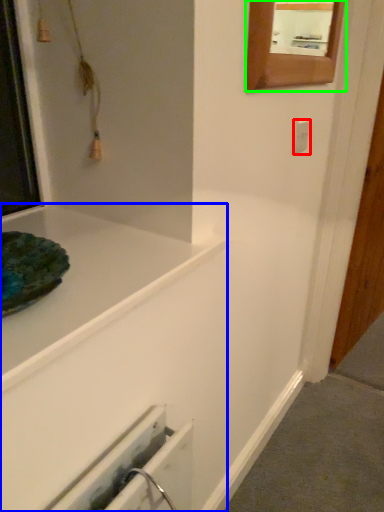
Question: Based on their relative distances, which object is nearer to electric outlet (highlighted by a red box)? Choose from bathtub (highlighted by a blue box) and mirror (highlighted by a green box).

Choices:
 (A) bathtub
 (B) mirror

Answer: (B)